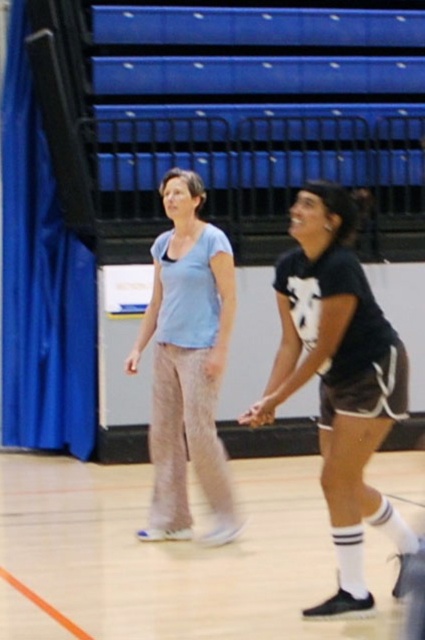
Question: Considering the relative positions of white rubber shoes at lower center and black matte shorts at center in the image provided, where is white rubber shoes at lower center located with respect to black matte shorts at center?

Choices:
 (A) left
 (B) right

Answer: (A)

Question: Based on their relative distances, which object is nearer to the white rubber shoes at lower center?

Choices:
 (A) light blue cotton shirt at center
 (B) black matte shorts at center

Answer: (B)

Question: Which of the following is the farthest from the observer?

Choices:
 (A) (292, 250)
 (B) (153, 502)
 (C) (85, 561)

Answer: (A)

Question: Which of the following is the farthest from the observer?

Choices:
 (A) black matte shorts at center
 (B) white rubber shoes at lower center
 (C) light blue cotton shirt at center

Answer: (C)

Question: Does white rubber shoes at lower center appear over black matte shorts at center?

Choices:
 (A) no
 (B) yes

Answer: (A)

Question: Can you confirm if white rubber shoes at lower center is positioned below light blue cotton shirt at center?

Choices:
 (A) yes
 (B) no

Answer: (A)